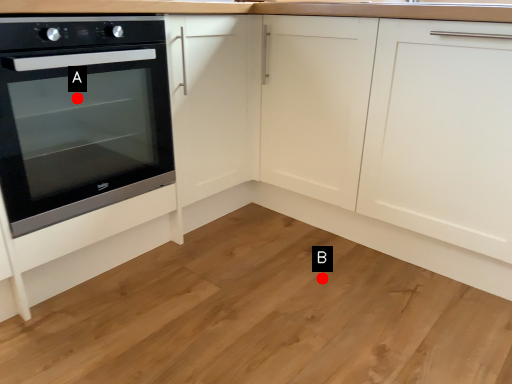
Question: Two points are circled on the image, labeled by A and B beside each circle. Which point is farther from the camera taking this photo?

Choices:
 (A) A is further
 (B) B is further

Answer: (A)